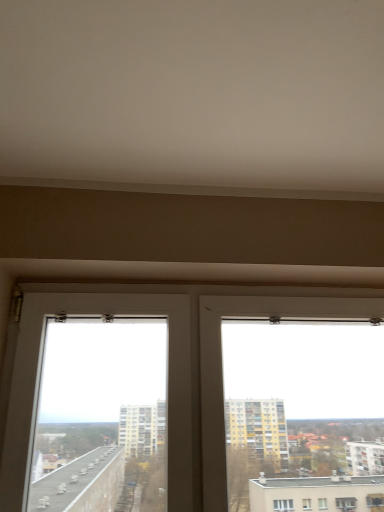
Where is `transparent glass window at center`? transparent glass window at center is located at coordinates [168, 368].

The height and width of the screenshot is (512, 384). Describe the element at coordinates (168, 368) in the screenshot. I see `transparent glass window at center` at that location.

Find the location of a particular element. This screenshot has height=512, width=384. transparent glass window at center is located at coordinates (168, 368).